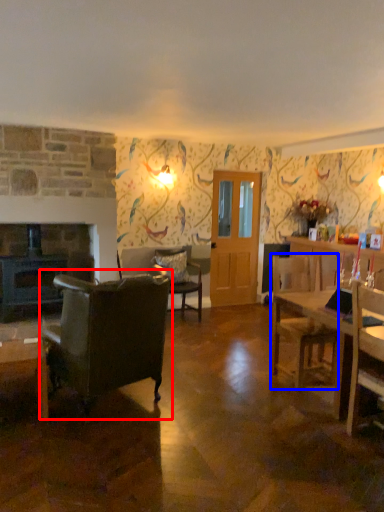
Question: Which object is closer to the camera taking this photo, chair (highlighted by a red box) or chair (highlighted by a blue box)?

Choices:
 (A) chair
 (B) chair

Answer: (A)